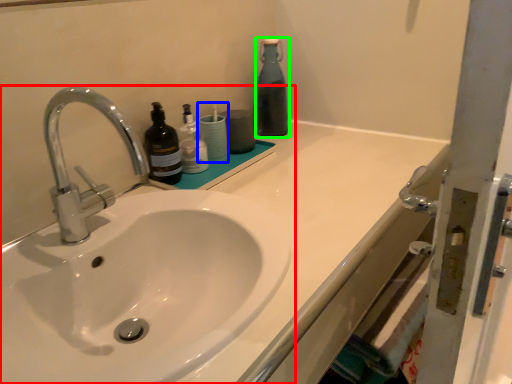
Question: Which object is the closest to the sink (highlighted by a red box)? Choose among these: toiletry (highlighted by a blue box) or bottle (highlighted by a green box).

Choices:
 (A) toiletry
 (B) bottle

Answer: (A)